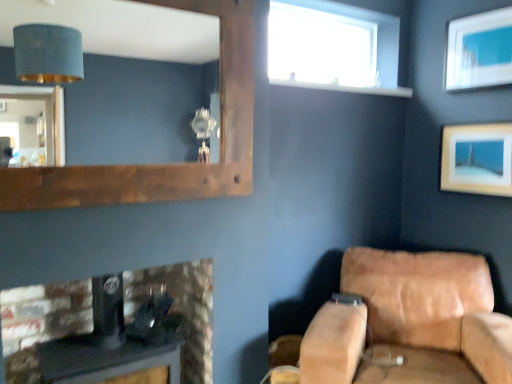
The height and width of the screenshot is (384, 512). What do you see at coordinates (113, 84) in the screenshot?
I see `brown wooden mirror at upper left` at bounding box center [113, 84].

This screenshot has height=384, width=512. Describe the element at coordinates (333, 47) in the screenshot. I see `transparent glass window at upper center` at that location.

Describe the element at coordinates (477, 159) in the screenshot. I see `wooden picture frame at upper right, the 2th picture frame from the top` at that location.

The image size is (512, 384). What do you see at coordinates (408, 323) in the screenshot? I see `tan leather couch at lower right` at bounding box center [408, 323].

Locate an element on the screen. matte white picture frame at upper right, which is the 1th picture frame in top-to-bottom order is located at coordinates (479, 50).

What do you see at coordinates (41, 321) in the screenshot? I see `black leather speaker at lower left` at bounding box center [41, 321].

Locate an element on the screen. The height and width of the screenshot is (384, 512). brown wooden mirror at upper left is located at coordinates (113, 84).

Are transparent glass window at upper center and wooden picture frame at upper right, which is the 1th picture frame from bottom to top, beside each other?

No, transparent glass window at upper center is not next to wooden picture frame at upper right, which is the 1th picture frame from bottom to top.

From the image's perspective, between transparent glass window at upper center and wooden picture frame at upper right, the 2th picture frame from the top, which one is located above?

From the image's view, transparent glass window at upper center is above.

From a real-world perspective, is transparent glass window at upper center positioned over wooden picture frame at upper right, the 2th picture frame from the top, based on gravity?

Correct, in the physical world, transparent glass window at upper center is higher than wooden picture frame at upper right, the 2th picture frame from the top.

Is transparent glass window at upper center bigger or smaller than wooden picture frame at upper right, the 2th picture frame from the top?

Considering their sizes, transparent glass window at upper center takes up more space than wooden picture frame at upper right, the 2th picture frame from the top.

This screenshot has height=384, width=512. In the image, there is a matte white picture frame at upper right, which is the 1th picture frame in top-to-bottom order. Identify the location of mirror below it (from a real-world perspective). (113, 84).

Is brown wooden mirror at upper left beside matte white picture frame at upper right, which is the 1th picture frame in top-to-bottom order?

No, brown wooden mirror at upper left is not making contact with matte white picture frame at upper right, which is the 1th picture frame in top-to-bottom order.

From the image's perspective, is brown wooden mirror at upper left located above or below matte white picture frame at upper right, arranged as the 2th picture frame when ordered from the bottom?

brown wooden mirror at upper left is below matte white picture frame at upper right, arranged as the 2th picture frame when ordered from the bottom.

Is brown wooden mirror at upper left looking in the opposite direction of matte white picture frame at upper right, which is the 1th picture frame in top-to-bottom order?

brown wooden mirror at upper left is not turned away from matte white picture frame at upper right, which is the 1th picture frame in top-to-bottom order.

From their relative heights in the image, would you say brown wooden mirror at upper left is taller or shorter than transparent glass window at upper center?

brown wooden mirror at upper left is taller than transparent glass window at upper center.

What are the coordinates of `mirror that is in front of the transparent glass window at upper center` in the screenshot? It's located at (113, 84).

Does brown wooden mirror at upper left contain transparent glass window at upper center?

No, transparent glass window at upper center is located outside of brown wooden mirror at upper left.

Looking at this image, are brown wooden mirror at upper left and transparent glass window at upper center far apart?

Indeed, brown wooden mirror at upper left is not near transparent glass window at upper center.

Between black leather speaker at lower left and brown wooden mirror at upper left, which one has larger width?

black leather speaker at lower left.

Which object is positioned more to the right, black leather speaker at lower left or brown wooden mirror at upper left?

brown wooden mirror at upper left.

Looking at this image, is tan leather couch at lower right next to brown wooden mirror at upper left?

No, tan leather couch at lower right is not next to brown wooden mirror at upper left.

Where is `mirror located above the tan leather couch at lower right (from a real-world perspective)`? The width and height of the screenshot is (512, 384). mirror located above the tan leather couch at lower right (from a real-world perspective) is located at coordinates (113, 84).

Considering the sizes of objects tan leather couch at lower right and brown wooden mirror at upper left in the image provided, who is thinner, tan leather couch at lower right or brown wooden mirror at upper left?

With smaller width is brown wooden mirror at upper left.

The width and height of the screenshot is (512, 384). I want to click on picture frame that is the 1st object above the black leather speaker at lower left (from a real-world perspective), so click(477, 159).

Is black leather speaker at lower left not within wooden picture frame at upper right, the 2th picture frame from the top?

Absolutely, black leather speaker at lower left is external to wooden picture frame at upper right, the 2th picture frame from the top.

Between black leather speaker at lower left and wooden picture frame at upper right, the 2th picture frame from the top, which one has smaller size?

wooden picture frame at upper right, the 2th picture frame from the top, is smaller.

From a real-world perspective, which object rests below the other?

black leather speaker at lower left is physically lower.

Is black leather speaker at lower left shorter than tan leather couch at lower right?

Yes.

Is black leather speaker at lower left wider than tan leather couch at lower right?

No, black leather speaker at lower left is not wider than tan leather couch at lower right.

Which of these two, black leather speaker at lower left or tan leather couch at lower right, is bigger?

tan leather couch at lower right is bigger.

Which object is further away from the camera taking this photo, black leather speaker at lower left or tan leather couch at lower right?

black leather speaker at lower left is behind.

Locate an element on the screen. picture frame that is the 2nd object directly below the transparent glass window at upper center (from a real-world perspective) is located at coordinates (477, 159).

The width and height of the screenshot is (512, 384). Find the location of `picture frame above the brown wooden mirror at upper left (from the image's perspective)`. picture frame above the brown wooden mirror at upper left (from the image's perspective) is located at coordinates (479, 50).

Based on their spatial positions, is brown wooden mirror at upper left or matte white picture frame at upper right, which is the 1th picture frame in top-to-bottom order, further from transparent glass window at upper center?

Based on the image, brown wooden mirror at upper left appears to be further to transparent glass window at upper center.

Based on their spatial positions, is black leather speaker at lower left or transparent glass window at upper center further from wooden picture frame at upper right, the 2th picture frame from the top?

Among the two, black leather speaker at lower left is located further to wooden picture frame at upper right, the 2th picture frame from the top.

Based on their spatial positions, is transparent glass window at upper center or brown wooden mirror at upper left further from black leather speaker at lower left?

brown wooden mirror at upper left is further to black leather speaker at lower left.

Looking at the image, which one is located further to wooden picture frame at upper right, the 2th picture frame from the top, transparent glass window at upper center or tan leather couch at lower right?

transparent glass window at upper center.

Looking at this image, looking at the image, which one is located closer to transparent glass window at upper center, black leather speaker at lower left or wooden picture frame at upper right, which is the 1th picture frame from bottom to top?

Among the two, wooden picture frame at upper right, which is the 1th picture frame from bottom to top, is located nearer to transparent glass window at upper center.

Which object lies nearer to the anchor point brown wooden mirror at upper left, matte white picture frame at upper right, which is the 1th picture frame in top-to-bottom order, or tan leather couch at lower right?

matte white picture frame at upper right, which is the 1th picture frame in top-to-bottom order.

From the image, which object appears to be nearer to brown wooden mirror at upper left, matte white picture frame at upper right, arranged as the 2th picture frame when ordered from the bottom, or black leather speaker at lower left?

matte white picture frame at upper right, arranged as the 2th picture frame when ordered from the bottom, lies closer to brown wooden mirror at upper left than the other object.

Based on their spatial positions, is wooden picture frame at upper right, the 2th picture frame from the top, or tan leather couch at lower right further from brown wooden mirror at upper left?

Based on the image, tan leather couch at lower right appears to be further to brown wooden mirror at upper left.

Where is `window between black leather speaker at lower left and matte white picture frame at upper right, arranged as the 2th picture frame when ordered from the bottom, from left to right`? The width and height of the screenshot is (512, 384). window between black leather speaker at lower left and matte white picture frame at upper right, arranged as the 2th picture frame when ordered from the bottom, from left to right is located at coordinates (333, 47).

The height and width of the screenshot is (384, 512). Find the location of `mirror between black leather speaker at lower left and matte white picture frame at upper right, arranged as the 2th picture frame when ordered from the bottom, from left to right`. mirror between black leather speaker at lower left and matte white picture frame at upper right, arranged as the 2th picture frame when ordered from the bottom, from left to right is located at coordinates (113, 84).

The image size is (512, 384). Identify the location of window located between brown wooden mirror at upper left and matte white picture frame at upper right, arranged as the 2th picture frame when ordered from the bottom, in the left-right direction. (333, 47).

Where is `mirror between black leather speaker at lower left and wooden picture frame at upper right, which is the 1th picture frame from bottom to top, in the horizontal direction`? mirror between black leather speaker at lower left and wooden picture frame at upper right, which is the 1th picture frame from bottom to top, in the horizontal direction is located at coordinates (113, 84).